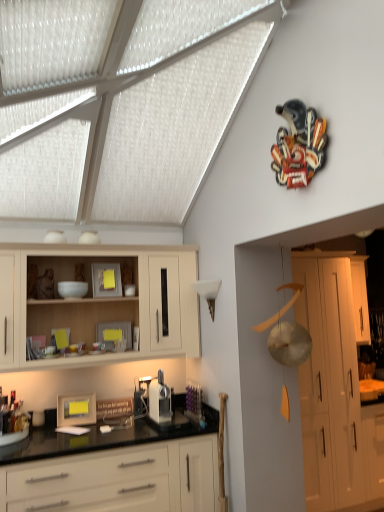
Find the location of a particular element. This screenshot has width=384, height=512. white glossy cabinet at right, which is the 1th cabinetry in right-to-left order is located at coordinates (360, 298).

Is white matte cabinet at right, which is the second cabinetry from right to left, positioned with its back to white glossy cabinet at right, positioned as the 4th cabinetry in left-to-right order?

white matte cabinet at right, which is the second cabinetry from right to left, does not have its back to white glossy cabinet at right, positioned as the 4th cabinetry in left-to-right order.

I want to click on cabinetry located behind the white matte cabinet at right, the third cabinetry viewed from the left, so click(x=360, y=298).

Consider the image. Which of these two, white matte cabinet at right, which is the second cabinetry from right to left, or white glossy cabinet at right, which is the 1th cabinetry in right-to-left order, is smaller?

Smaller between the two is white glossy cabinet at right, which is the 1th cabinetry in right-to-left order.

In the image, is white glossy cabinet at right, positioned as the 4th cabinetry in left-to-right order, on the left side or the right side of white glossy cabinets at lower center, the second cabinetry from the left?

In the image, white glossy cabinet at right, positioned as the 4th cabinetry in left-to-right order, appears on the right side of white glossy cabinets at lower center, the second cabinetry from the left.

Could white glossy cabinets at lower center, marked as the third cabinetry in a right-to-left arrangement, be considered to be inside white glossy cabinet at right, which is the 1th cabinetry in right-to-left order?

That's incorrect, white glossy cabinets at lower center, marked as the third cabinetry in a right-to-left arrangement, is not inside white glossy cabinet at right, which is the 1th cabinetry in right-to-left order.

Is white glossy cabinet at right, which is the 1th cabinetry in right-to-left order, bigger than white glossy cabinets at lower center, marked as the third cabinetry in a right-to-left arrangement?

No, white glossy cabinet at right, which is the 1th cabinetry in right-to-left order, is not bigger than white glossy cabinets at lower center, marked as the third cabinetry in a right-to-left arrangement.

Can white matte cabinet at right, which is the second cabinetry from right to left, be found inside white glossy cabinet at right, positioned as the 4th cabinetry in left-to-right order?

Definitely not — white matte cabinet at right, which is the second cabinetry from right to left, is not inside white glossy cabinet at right, positioned as the 4th cabinetry in left-to-right order.

Which object is positioned more to the right, white glossy cabinet at right, positioned as the 4th cabinetry in left-to-right order, or white matte cabinet at right, the third cabinetry viewed from the left?

From the viewer's perspective, white glossy cabinet at right, positioned as the 4th cabinetry in left-to-right order, appears more on the right side.

Consider the image. From the image's perspective, is white glossy cabinet at right, which is the 1th cabinetry in right-to-left order, on top of white matte cabinet at right, which is the second cabinetry from right to left?

Yes, from the image's perspective, white glossy cabinet at right, which is the 1th cabinetry in right-to-left order, is above white matte cabinet at right, which is the second cabinetry from right to left.

Considering the relative positions of white matte cabinet at right, the third cabinetry viewed from the left, and matte wooden picture frame at lower left in the image provided, is white matte cabinet at right, the third cabinetry viewed from the left, in front of matte wooden picture frame at lower left?

No, white matte cabinet at right, the third cabinetry viewed from the left, is further to the viewer.

Which of these two, white matte cabinet at right, the third cabinetry viewed from the left, or matte wooden picture frame at lower left, is thinner?

matte wooden picture frame at lower left.

Is white matte cabinet at right, the third cabinetry viewed from the left, with matte wooden picture frame at lower left?

white matte cabinet at right, the third cabinetry viewed from the left, and matte wooden picture frame at lower left are not in contact.

Which is farther, (305, 426) or (60, 398)?

The point (305, 426) is behind.

Is white matte cabinet at right, the third cabinetry viewed from the left, wider than white glossy cabinets at lower center, marked as the third cabinetry in a right-to-left arrangement?

Yes.

Looking at the image, does white matte cabinet at right, the third cabinetry viewed from the left, seem bigger or smaller compared to white glossy cabinets at lower center, marked as the third cabinetry in a right-to-left arrangement?

In the image, white matte cabinet at right, the third cabinetry viewed from the left, appears to be larger than white glossy cabinets at lower center, marked as the third cabinetry in a right-to-left arrangement.

Can you tell me how much white matte cabinet at right, which is the second cabinetry from right to left, and white glossy cabinets at lower center, marked as the third cabinetry in a right-to-left arrangement, differ in facing direction?

0.112 degrees separate the facing orientations of white matte cabinet at right, which is the second cabinetry from right to left, and white glossy cabinets at lower center, marked as the third cabinetry in a right-to-left arrangement.

Is white matte cabinet at right, which is the second cabinetry from right to left, next to white glossy cabinets at lower center, marked as the third cabinetry in a right-to-left arrangement?

No, white matte cabinet at right, which is the second cabinetry from right to left, is not making contact with white glossy cabinets at lower center, marked as the third cabinetry in a right-to-left arrangement.

In terms of width, does matte wooden picture frame at lower left look wider or thinner when compared to white glossy cabinets at lower center, marked as the third cabinetry in a right-to-left arrangement?

In the image, matte wooden picture frame at lower left appears to be more narrow than white glossy cabinets at lower center, marked as the third cabinetry in a right-to-left arrangement.

How many degrees apart are the facing directions of matte wooden picture frame at lower left and white glossy cabinets at lower center, marked as the third cabinetry in a right-to-left arrangement?

matte wooden picture frame at lower left and white glossy cabinets at lower center, marked as the third cabinetry in a right-to-left arrangement, are facing 4.68 degrees away from each other.

Which is more to the right, matte wooden picture frame at lower left or white glossy cabinets at lower center, marked as the third cabinetry in a right-to-left arrangement?

white glossy cabinets at lower center, marked as the third cabinetry in a right-to-left arrangement.

From the matte wooden picture frame at lower left, count 1st cabinetrys forward and point to it. Please provide its 2D coordinates.

[(100, 301)]

Is the surface of light wood cabinet at upper left, which appears as the 1th cabinetry when viewed from the left, in direct contact with matte wooden picture frame at lower left?

No, light wood cabinet at upper left, which appears as the 1th cabinetry when viewed from the left, is not making contact with matte wooden picture frame at lower left.

Can you tell me how much light wood cabinet at upper left, acting as the 4th cabinetry starting from the right, and matte wooden picture frame at lower left differ in facing direction?

The facing directions of light wood cabinet at upper left, acting as the 4th cabinetry starting from the right, and matte wooden picture frame at lower left are 4.96 degrees apart.

From the image's perspective, which is above, light wood cabinet at upper left, which appears as the 1th cabinetry when viewed from the left, or matte wooden picture frame at lower left?

From the image's view, light wood cabinet at upper left, which appears as the 1th cabinetry when viewed from the left, is above.

Find the location of a particular element. the 1st cabinetry counting from the left side of the white glossy cabinet at right, which is the 1th cabinetry in right-to-left order is located at coordinates (335, 393).

At what (x,y) coordinates should I click in order to perform the action: click on cabinetry that is the 2nd object to the right of the white glossy cabinets at lower center, marked as the third cabinetry in a right-to-left arrangement, starting at the anchor. Please return your answer as a coordinate pair (x, y). Looking at the image, I should click on (360, 298).

Which object lies further to the anchor point matte wooden picture frame at lower left, light wood cabinet at upper left, which appears as the 1th cabinetry when viewed from the left, or white matte cabinet at right, which is the second cabinetry from right to left?

white matte cabinet at right, which is the second cabinetry from right to left, lies further to matte wooden picture frame at lower left than the other object.

Looking at the image, which one is located further to light wood cabinet at upper left, acting as the 4th cabinetry starting from the right, white matte cabinet at right, the third cabinetry viewed from the left, or matte wooden picture frame at lower left?

The object further to light wood cabinet at upper left, acting as the 4th cabinetry starting from the right, is white matte cabinet at right, the third cabinetry viewed from the left.

Based on their spatial positions, is matte wooden picture frame at lower left or white glossy cabinets at lower center, the second cabinetry from the left, closer to light wood cabinet at upper left, which appears as the 1th cabinetry when viewed from the left?

matte wooden picture frame at lower left is positioned closer to the anchor light wood cabinet at upper left, which appears as the 1th cabinetry when viewed from the left.

Which object lies nearer to the anchor point white glossy cabinet at right, which is the 1th cabinetry in right-to-left order, white matte cabinet at right, the third cabinetry viewed from the left, or matte wooden picture frame at lower left?

white matte cabinet at right, the third cabinetry viewed from the left, is positioned closer to the anchor white glossy cabinet at right, which is the 1th cabinetry in right-to-left order.

Based on their spatial positions, is light wood cabinet at upper left, acting as the 4th cabinetry starting from the right, or white glossy cabinet at right, positioned as the 4th cabinetry in left-to-right order, closer to white glossy cabinets at lower center, marked as the third cabinetry in a right-to-left arrangement?

light wood cabinet at upper left, acting as the 4th cabinetry starting from the right, is closer to white glossy cabinets at lower center, marked as the third cabinetry in a right-to-left arrangement.

Looking at the image, which one is located further to white glossy cabinet at right, positioned as the 4th cabinetry in left-to-right order, white glossy cabinets at lower center, the second cabinetry from the left, or matte wooden picture frame at lower left?

matte wooden picture frame at lower left is further to white glossy cabinet at right, positioned as the 4th cabinetry in left-to-right order.

Looking at the image, which one is located further to light wood cabinet at upper left, which appears as the 1th cabinetry when viewed from the left, white glossy cabinet at right, positioned as the 4th cabinetry in left-to-right order, or matte wooden picture frame at lower left?

white glossy cabinet at right, positioned as the 4th cabinetry in left-to-right order, lies further to light wood cabinet at upper left, which appears as the 1th cabinetry when viewed from the left, than the other object.

Considering their positions, is white glossy cabinets at lower center, the second cabinetry from the left, positioned closer to matte wooden picture frame at lower left than light wood cabinet at upper left, which appears as the 1th cabinetry when viewed from the left?

white glossy cabinets at lower center, the second cabinetry from the left, lies closer to matte wooden picture frame at lower left than the other object.

Identify the location of cabinetry between light wood cabinet at upper left, acting as the 4th cabinetry starting from the right, and white matte cabinet at right, which is the second cabinetry from right to left. This screenshot has width=384, height=512. (119, 480).

This screenshot has height=512, width=384. Identify the location of cabinetry situated between white glossy cabinets at lower center, marked as the third cabinetry in a right-to-left arrangement, and white glossy cabinet at right, which is the 1th cabinetry in right-to-left order, from left to right. (335, 393).

You are a GUI agent. You are given a task and a screenshot of the screen. Output one action in this format:
    pyautogui.click(x=<x>, y=<y>)
    Task: Click on the picture frame between light wood cabinet at upper left, which appears as the 1th cabinetry when viewed from the left, and white glossy cabinets at lower center, marked as the third cabinetry in a right-to-left arrangement, from top to bottom
    Image resolution: width=384 pixels, height=512 pixels.
    Given the screenshot: What is the action you would take?
    pyautogui.click(x=76, y=410)